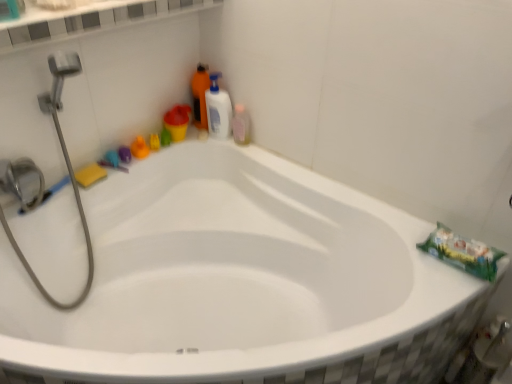
What is the approximate height of white glossy bottle at upper right, marked as the second cleaning product in a left-to-right arrangement?

white glossy bottle at upper right, marked as the second cleaning product in a left-to-right arrangement, is 10.27 inches tall.

What is the approximate width of white glossy bottle at upper right, marked as the second cleaning product in a left-to-right arrangement?

It is 3.54 inches.

Image resolution: width=512 pixels, height=384 pixels. What are the coordinates of `orange matte bottle at upper center, which is the 1th cleaning product in left-to-right order` in the screenshot? It's located at (200, 95).

The width and height of the screenshot is (512, 384). What do you see at coordinates (241, 125) in the screenshot? I see `pink translucent bottle at upper right` at bounding box center [241, 125].

Where is `white glossy bottle at upper right, the 1th cleaning product positioned from the right`? The image size is (512, 384). white glossy bottle at upper right, the 1th cleaning product positioned from the right is located at coordinates (218, 109).

From the image's perspective, is yellow sponge at upper left positioned above or below white glossy bottle at upper right, marked as the second cleaning product in a left-to-right arrangement?

yellow sponge at upper left is situated lower than white glossy bottle at upper right, marked as the second cleaning product in a left-to-right arrangement, in the image.

Who is more distant, yellow sponge at upper left or white glossy bottle at upper right, marked as the second cleaning product in a left-to-right arrangement?

white glossy bottle at upper right, marked as the second cleaning product in a left-to-right arrangement, is further from the camera.

Does point (94, 182) come behind point (217, 125)?

No, (94, 182) is in front of (217, 125).

Between yellow sponge at upper left and white glossy bottle at upper right, the 1th cleaning product positioned from the right, which one appears on the right side from the viewer's perspective?

From the viewer's perspective, white glossy bottle at upper right, the 1th cleaning product positioned from the right, appears more on the right side.

From the image's perspective, which is above, orange matte bottle at upper center, which is the 1th cleaning product in left-to-right order, or yellow sponge at upper left?

orange matte bottle at upper center, which is the 1th cleaning product in left-to-right order.

Considering the relative sizes of orange matte bottle at upper center, which is the 1th cleaning product in left-to-right order, and yellow sponge at upper left in the image provided, is orange matte bottle at upper center, which is the 1th cleaning product in left-to-right order, smaller than yellow sponge at upper left?

No, orange matte bottle at upper center, which is the 1th cleaning product in left-to-right order, is not smaller than yellow sponge at upper left.

Is orange matte bottle at upper center, which is the 1th cleaning product in left-to-right order, not near yellow sponge at upper left?

Actually, orange matte bottle at upper center, which is the 1th cleaning product in left-to-right order, and yellow sponge at upper left are a little close together.

Looking at this image, is orange matte bottle at upper center, which is the 1th cleaning product in left-to-right order, spatially inside yellow sponge at upper left, or outside of it?

orange matte bottle at upper center, which is the 1th cleaning product in left-to-right order, is spatially situated outside yellow sponge at upper left.

Is white glossy ledge at upper center not inside pink translucent bottle at upper right?

Absolutely, white glossy ledge at upper center is external to pink translucent bottle at upper right.

Can you tell me how much white glossy ledge at upper center and pink translucent bottle at upper right differ in facing direction?

They differ by 80.4 degrees in their facing directions.

From the image's perspective, is white glossy ledge at upper center below pink translucent bottle at upper right?

Result: Incorrect, from the image's perspective, white glossy ledge at upper center is higher than pink translucent bottle at upper right.

Where is `ledge that appears in front of the pink translucent bottle at upper right`? This screenshot has width=512, height=384. ledge that appears in front of the pink translucent bottle at upper right is located at coordinates (94, 22).

From a real-world perspective, is orange matte bottle at upper center, arranged as the 2th cleaning product when viewed from the right, beneath white glossy bottle at upper right, marked as the second cleaning product in a left-to-right arrangement?

No, from a real-world perspective, orange matte bottle at upper center, arranged as the 2th cleaning product when viewed from the right, is not under white glossy bottle at upper right, marked as the second cleaning product in a left-to-right arrangement.

Who is smaller, orange matte bottle at upper center, which is the 1th cleaning product in left-to-right order, or white glossy bottle at upper right, the 1th cleaning product positioned from the right?

With smaller size is orange matte bottle at upper center, which is the 1th cleaning product in left-to-right order.

What's the angular difference between orange matte bottle at upper center, which is the 1th cleaning product in left-to-right order, and white glossy bottle at upper right, marked as the second cleaning product in a left-to-right arrangement,'s facing directions?

The facing directions of orange matte bottle at upper center, which is the 1th cleaning product in left-to-right order, and white glossy bottle at upper right, marked as the second cleaning product in a left-to-right arrangement, are 75.1 degrees apart.

Considering the sizes of orange matte bottle at upper center, arranged as the 2th cleaning product when viewed from the right, and white glossy bottle at upper right, the 1th cleaning product positioned from the right, in the image, is orange matte bottle at upper center, arranged as the 2th cleaning product when viewed from the right, taller or shorter than white glossy bottle at upper right, the 1th cleaning product positioned from the right,?

Clearly, orange matte bottle at upper center, arranged as the 2th cleaning product when viewed from the right, is taller compared to white glossy bottle at upper right, the 1th cleaning product positioned from the right.

Is pink translucent bottle at upper right inside the boundaries of orange matte bottle at upper center, which is the 1th cleaning product in left-to-right order, or outside?

pink translucent bottle at upper right is outside orange matte bottle at upper center, which is the 1th cleaning product in left-to-right order.

Does pink translucent bottle at upper right appear on the right side of orange matte bottle at upper center, which is the 1th cleaning product in left-to-right order?

Yes, pink translucent bottle at upper right is to the right of orange matte bottle at upper center, which is the 1th cleaning product in left-to-right order.

How much distance is there between pink translucent bottle at upper right and orange matte bottle at upper center, arranged as the 2th cleaning product when viewed from the right?

pink translucent bottle at upper right and orange matte bottle at upper center, arranged as the 2th cleaning product when viewed from the right, are 7.14 inches apart.

Is pink translucent bottle at upper right oriented towards orange matte bottle at upper center, arranged as the 2th cleaning product when viewed from the right?

No, pink translucent bottle at upper right is not facing towards orange matte bottle at upper center, arranged as the 2th cleaning product when viewed from the right.

From the picture: How many degrees apart are the facing directions of white glossy bottle at upper right, marked as the second cleaning product in a left-to-right arrangement, and yellow sponge at upper left?

The angle between the facing direction of white glossy bottle at upper right, marked as the second cleaning product in a left-to-right arrangement, and the facing direction of yellow sponge at upper left is 82 degrees.

From the image's perspective, is white glossy bottle at upper right, the 1th cleaning product positioned from the right, on yellow sponge at upper left?

Yes, from the image's perspective, white glossy bottle at upper right, the 1th cleaning product positioned from the right, is above yellow sponge at upper left.

Is white glossy bottle at upper right, the 1th cleaning product positioned from the right, not within yellow sponge at upper left?

Yes, white glossy bottle at upper right, the 1th cleaning product positioned from the right, is not within yellow sponge at upper left.

Between point (12, 47) and point (198, 93), which one is positioned in front?

Positioned in front is point (12, 47).

Considering the relative sizes of white glossy ledge at upper center and orange matte bottle at upper center, arranged as the 2th cleaning product when viewed from the right, in the image provided, is white glossy ledge at upper center taller than orange matte bottle at upper center, arranged as the 2th cleaning product when viewed from the right,?

In fact, white glossy ledge at upper center may be shorter than orange matte bottle at upper center, arranged as the 2th cleaning product when viewed from the right.

Find the location of a particular element. Image resolution: width=512 pixels, height=384 pixels. the 1st cleaning product positioned below the white glossy ledge at upper center (from the image's perspective) is located at coordinates (200, 95).

At what (x,y) coordinates should I click in order to perform the action: click on the 1st cleaning product positioned above the yellow sponge at upper left (from the image's perspective). Please return your answer as a coordinate pair (x, y). Looking at the image, I should click on (218, 109).

Image resolution: width=512 pixels, height=384 pixels. In the image, there is a orange matte bottle at upper center, arranged as the 2th cleaning product when viewed from the right. In order to click on soap below it (from the image's perspective) in this screenshot , I will do `click(90, 175)`.

Looking at the image, which one is located closer to white glossy bottle at upper right, marked as the second cleaning product in a left-to-right arrangement, pink translucent bottle at upper right or orange matte bottle at upper center, arranged as the 2th cleaning product when viewed from the right?

pink translucent bottle at upper right lies closer to white glossy bottle at upper right, marked as the second cleaning product in a left-to-right arrangement, than the other object.

Based on their spatial positions, is white glossy ledge at upper center or pink translucent bottle at upper right further from orange matte bottle at upper center, which is the 1th cleaning product in left-to-right order?

white glossy ledge at upper center is further to orange matte bottle at upper center, which is the 1th cleaning product in left-to-right order.

Which object lies nearer to the anchor point orange matte bottle at upper center, arranged as the 2th cleaning product when viewed from the right, white glossy ledge at upper center or white glossy bottle at upper right, marked as the second cleaning product in a left-to-right arrangement?

The object closer to orange matte bottle at upper center, arranged as the 2th cleaning product when viewed from the right, is white glossy bottle at upper right, marked as the second cleaning product in a left-to-right arrangement.

When comparing their distances from orange matte bottle at upper center, which is the 1th cleaning product in left-to-right order, does yellow sponge at upper left or pink translucent bottle at upper right seem further?

Based on the image, yellow sponge at upper left appears to be further to orange matte bottle at upper center, which is the 1th cleaning product in left-to-right order.

Consider the image. Looking at the image, which one is located closer to white glossy bottle at upper right, marked as the second cleaning product in a left-to-right arrangement, orange matte bottle at upper center, which is the 1th cleaning product in left-to-right order, or pink translucent bottle at upper right?

Among the two, pink translucent bottle at upper right is located nearer to white glossy bottle at upper right, marked as the second cleaning product in a left-to-right arrangement.

Looking at this image, considering their positions, is pink translucent bottle at upper right positioned further to white glossy ledge at upper center than white glossy bottle at upper right, marked as the second cleaning product in a left-to-right arrangement?

pink translucent bottle at upper right is further to white glossy ledge at upper center.

Based on their spatial positions, is white glossy bottle at upper right, marked as the second cleaning product in a left-to-right arrangement, or yellow sponge at upper left further from white glossy ledge at upper center?

The object further to white glossy ledge at upper center is yellow sponge at upper left.

From the image, which object appears to be nearer to yellow sponge at upper left, pink translucent bottle at upper right or white glossy bottle at upper right, the 1th cleaning product positioned from the right?

Among the two, white glossy bottle at upper right, the 1th cleaning product positioned from the right, is located nearer to yellow sponge at upper left.

At what (x,y) coordinates should I click in order to perform the action: click on soap between white glossy ledge at upper center and pink translucent bottle at upper right along the z-axis. Please return your answer as a coordinate pair (x, y). The width and height of the screenshot is (512, 384). Looking at the image, I should click on (90, 175).

At what (x,y) coordinates should I click in order to perform the action: click on cleaning product between white glossy ledge at upper center and orange matte bottle at upper center, arranged as the 2th cleaning product when viewed from the right, in the front-back direction. Please return your answer as a coordinate pair (x, y). Looking at the image, I should click on (218, 109).

Identify the location of mouthwash between white glossy ledge at upper center and orange matte bottle at upper center, arranged as the 2th cleaning product when viewed from the right, in the front-back direction. (241, 125).

The image size is (512, 384). I want to click on cleaning product between yellow sponge at upper left and white glossy bottle at upper right, marked as the second cleaning product in a left-to-right arrangement, so click(200, 95).